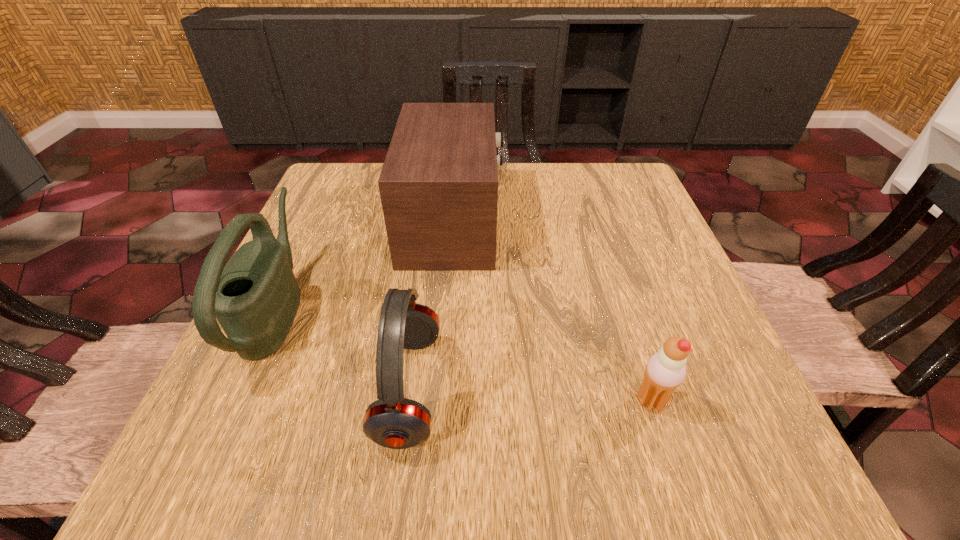
The width and height of the screenshot is (960, 540). Identify the location of vacant space at the near right corner of the desktop. (671, 434).

Image resolution: width=960 pixels, height=540 pixels. I want to click on free space between the earphone and the leftmost object, so click(x=344, y=348).

You are a GUI agent. You are given a task and a screenshot of the screen. Output one action in this format:
    pyautogui.click(x=<x>, y=<y>)
    Task: Click on the vacant point located between the icecream and the radio receiver
    
    Given the screenshot: What is the action you would take?
    pyautogui.click(x=552, y=311)

What are the coordinates of `vacant region between the icecream and the earphone` in the screenshot? It's located at (x=530, y=395).

Locate an element on the screen. Image resolution: width=960 pixels, height=540 pixels. vacant space that's between the radio receiver and the rightmost object is located at coordinates (552, 311).

Identify the location of free space between the earphone and the icecream. (530, 395).

You are a GUI agent. You are given a task and a screenshot of the screen. Output one action in this format:
    pyautogui.click(x=<x>, y=<y>)
    Task: Click on the vacant space that is in between the watering can and the radio receiver
    
    Given the screenshot: What is the action you would take?
    pyautogui.click(x=366, y=265)

This screenshot has width=960, height=540. In order to click on empty space between the leftmost object and the earphone in this screenshot , I will do `click(344, 348)`.

Where is `vacant region between the radio receiver and the earphone`? The height and width of the screenshot is (540, 960). vacant region between the radio receiver and the earphone is located at coordinates (431, 305).

Find the location of a particular element. This screenshot has height=540, width=960. vacant space that is in between the earphone and the radio receiver is located at coordinates (431, 305).